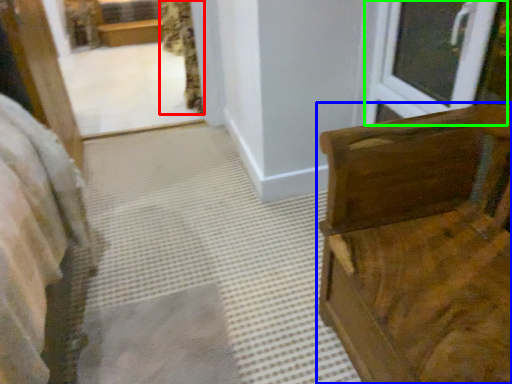
Question: Estimate the real-world distances between objects in this image. Which object is closer to curtain (highlighted by a red box), furniture (highlighted by a blue box) or window (highlighted by a green box)?

Choices:
 (A) furniture
 (B) window

Answer: (B)